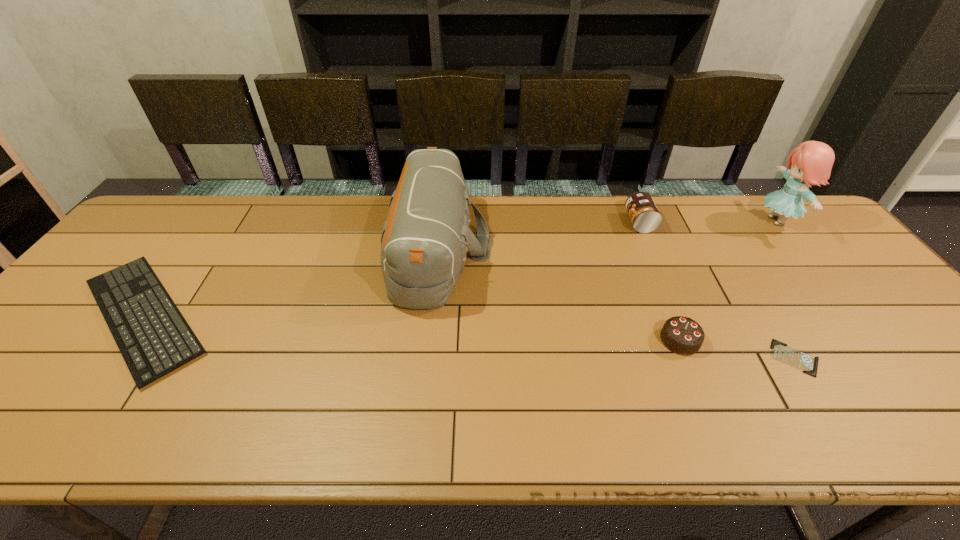
Locate an element on the screen. This screenshot has height=540, width=960. vacant region between the fifth object from right to left and the rightmost object is located at coordinates (608, 234).

This screenshot has width=960, height=540. I want to click on vacant space that is in between the fourth tallest object and the fifth object from left to right, so click(x=737, y=349).

Where is `vacant space that's between the fifth object from left to right and the rightmost object`? vacant space that's between the fifth object from left to right and the rightmost object is located at coordinates (786, 289).

The height and width of the screenshot is (540, 960). What are the coordinates of `free space between the fourth tallest object and the rightmost object` in the screenshot? It's located at (729, 281).

The image size is (960, 540). What are the coordinates of `vacant region between the third tallest object and the tallest object` in the screenshot? It's located at (708, 222).

At what (x,y) coordinates should I click in order to perform the action: click on object that is the third closest to the can. Please return your answer as a coordinate pair (x, y). Looking at the image, I should click on (424, 239).

Select which object appears as the second closest to the second object from left to right. Please provide its 2D coordinates. Your answer should be formatted as a tuple, i.e. [(x, y)], where the tuple contains the x and y coordinates of a point satisfying the conditions above.

[(681, 335)]

Locate an element on the screen. Image resolution: width=960 pixels, height=540 pixels. vacant space that satisfies the following two spatial constraints: 1. on the front side of the chocolate cake; 2. on the left side of the fifth shortest object is located at coordinates (429, 340).